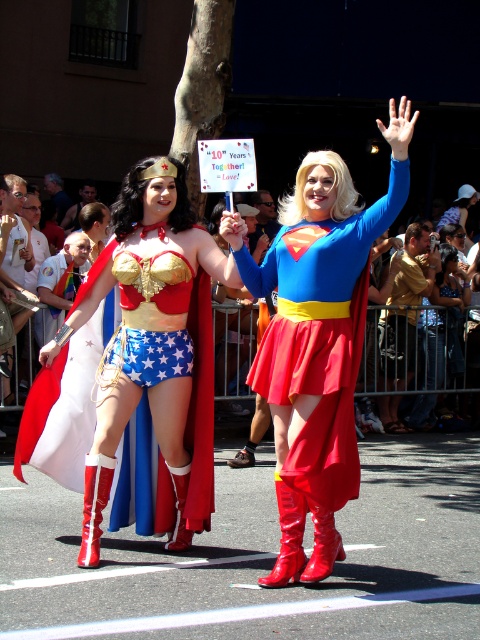
Question: Which point is closer to the camera?

Choices:
 (A) shiny red boots at center
 (B) shiny metallic cape at center

Answer: (A)

Question: Is shiny red boots at center below shiny metallic cape at center?

Choices:
 (A) no
 (B) yes

Answer: (A)

Question: Where is shiny red boots at center located in relation to shiny metallic cape at center in the image?

Choices:
 (A) right
 (B) left

Answer: (A)

Question: Which of the following is the closest to the observer?

Choices:
 (A) shiny metallic cape at center
 (B) shiny red boots at center

Answer: (B)

Question: Does shiny red boots at center have a lesser width compared to shiny metallic cape at center?

Choices:
 (A) yes
 (B) no

Answer: (A)